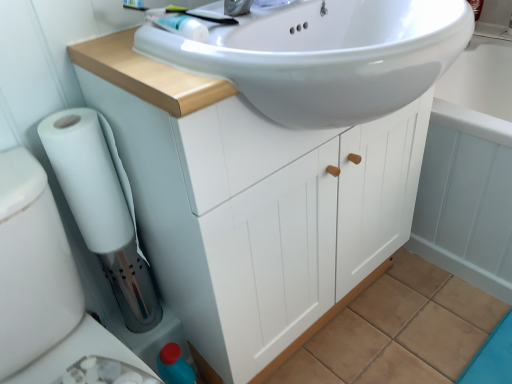
Question: Considering the relative sizes of white glossy bath at center and white matte cabinet at center in the image provided, is white glossy bath at center smaller than white matte cabinet at center?

Choices:
 (A) no
 (B) yes

Answer: (A)

Question: Is white glossy bath at center oriented away from white matte cabinet at center?

Choices:
 (A) yes
 (B) no

Answer: (B)

Question: Is the position of white glossy bath at center more distant than that of white matte cabinet at center?

Choices:
 (A) no
 (B) yes

Answer: (B)

Question: Is white glossy bath at center not inside white matte cabinet at center?

Choices:
 (A) yes
 (B) no

Answer: (A)

Question: Is white glossy bath at center in contact with white matte cabinet at center?

Choices:
 (A) yes
 (B) no

Answer: (B)

Question: Considering the relative sizes of white glossy bath at center and white matte cabinet at center in the image provided, is white glossy bath at center wider than white matte cabinet at center?

Choices:
 (A) no
 (B) yes

Answer: (B)

Question: Does blue plastic bidet at lower left, which appears as the 2th bidet when ordered from the bottom, appear on the right side of white matte toilet paper at lower left?

Choices:
 (A) yes
 (B) no

Answer: (B)

Question: Is blue plastic bidet at lower left, which appears as the 2th bidet when ordered from the bottom, positioned far away from white matte toilet paper at lower left?

Choices:
 (A) yes
 (B) no

Answer: (B)

Question: Is the depth of blue plastic bidet at lower left, positioned as the first bidet in top-to-bottom order, greater than that of white matte toilet paper at lower left?

Choices:
 (A) yes
 (B) no

Answer: (A)

Question: Can you confirm if blue plastic bidet at lower left, positioned as the first bidet in top-to-bottom order, is smaller than white matte toilet paper at lower left?

Choices:
 (A) no
 (B) yes

Answer: (B)

Question: Does blue plastic bidet at lower left, which appears as the 2th bidet when ordered from the bottom, have a greater height compared to white matte toilet paper at lower left?

Choices:
 (A) yes
 (B) no

Answer: (B)

Question: Considering the relative sizes of blue plastic bidet at lower left, which appears as the 2th bidet when ordered from the bottom, and white matte toilet paper at lower left in the image provided, is blue plastic bidet at lower left, which appears as the 2th bidet when ordered from the bottom, thinner than white matte toilet paper at lower left?

Choices:
 (A) yes
 (B) no

Answer: (A)

Question: From a real-world perspective, is white glossy sink at upper center positioned under white matte cabinet at center based on gravity?

Choices:
 (A) no
 (B) yes

Answer: (A)